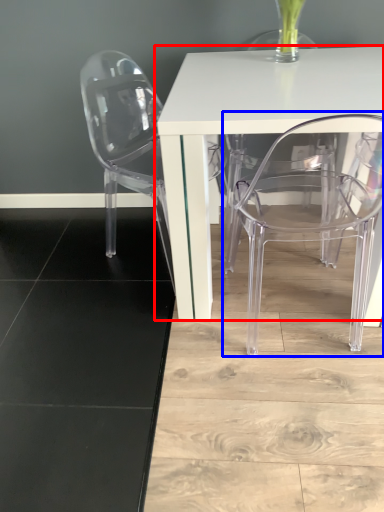
Question: Which point is further to the camera, table (highlighted by a red box) or chair (highlighted by a blue box)?

Choices:
 (A) table
 (B) chair

Answer: (A)